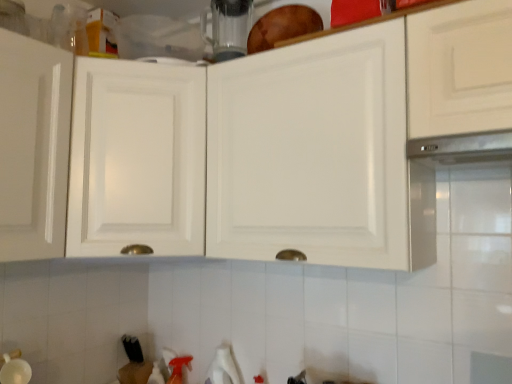
Question: Can you confirm if white glossy cabinet at upper center, marked as the second cabinetry in a left-to-right arrangement, is wider than satin metallic exhaust hood at upper right?

Choices:
 (A) no
 (B) yes

Answer: (A)

Question: From a real-world perspective, is white glossy cabinet at upper center, marked as the second cabinetry in a left-to-right arrangement, located beneath satin metallic exhaust hood at upper right?

Choices:
 (A) yes
 (B) no

Answer: (B)

Question: Could you tell me if white glossy cabinet at upper center, placed as the first cabinetry when sorted from right to left, is facing satin metallic exhaust hood at upper right?

Choices:
 (A) no
 (B) yes

Answer: (B)

Question: Does white glossy cabinet at upper center, marked as the second cabinetry in a left-to-right arrangement, have a larger size compared to satin metallic exhaust hood at upper right?

Choices:
 (A) no
 (B) yes

Answer: (B)

Question: From the image's perspective, is white glossy cabinet at upper center, marked as the second cabinetry in a left-to-right arrangement, below satin metallic exhaust hood at upper right?

Choices:
 (A) yes
 (B) no

Answer: (A)

Question: Is white glossy cabinet at upper center, placed as the first cabinetry when sorted from right to left, taller or shorter than transparent glass blender at upper center?

Choices:
 (A) short
 (B) tall

Answer: (B)

Question: Is point (404, 190) positioned closer to the camera than point (219, 31)?

Choices:
 (A) closer
 (B) farther

Answer: (A)

Question: In terms of size, does white glossy cabinet at upper center, marked as the second cabinetry in a left-to-right arrangement, appear bigger or smaller than transparent glass blender at upper center?

Choices:
 (A) big
 (B) small

Answer: (A)

Question: In the image, is white glossy cabinet at upper center, marked as the second cabinetry in a left-to-right arrangement, on the left side or the right side of transparent glass blender at upper center?

Choices:
 (A) left
 (B) right

Answer: (B)

Question: From the image's perspective, relative to white glossy cabinet at upper center, the first cabinetry from the left, is satin metallic exhaust hood at upper right above or below?

Choices:
 (A) below
 (B) above

Answer: (B)

Question: Which is correct: satin metallic exhaust hood at upper right is inside white glossy cabinet at upper center, the first cabinetry from the left, or outside of it?

Choices:
 (A) inside
 (B) outside

Answer: (B)

Question: Is satin metallic exhaust hood at upper right in front of or behind white glossy cabinet at upper center, the first cabinetry from the left, in the image?

Choices:
 (A) front
 (B) behind

Answer: (A)

Question: In terms of size, does satin metallic exhaust hood at upper right appear bigger or smaller than white glossy cabinet at upper center, the first cabinetry from the left?

Choices:
 (A) big
 (B) small

Answer: (B)

Question: In terms of width, does transparent glass blender at upper center look wider or thinner when compared to white glossy cabinet at upper center, the first cabinetry from the left?

Choices:
 (A) wide
 (B) thin

Answer: (B)

Question: Considering the relative positions of transparent glass blender at upper center and white glossy cabinet at upper center, the second cabinetry viewed from the right, in the image provided, is transparent glass blender at upper center to the left or to the right of white glossy cabinet at upper center, the second cabinetry viewed from the right,?

Choices:
 (A) right
 (B) left

Answer: (A)